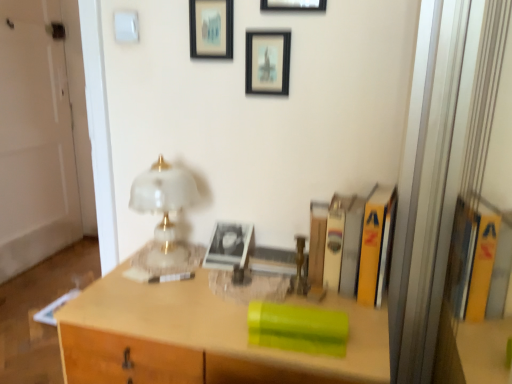
Where is `free space on the front side of matte glass table lamp at center`? The height and width of the screenshot is (384, 512). free space on the front side of matte glass table lamp at center is located at coordinates (140, 293).